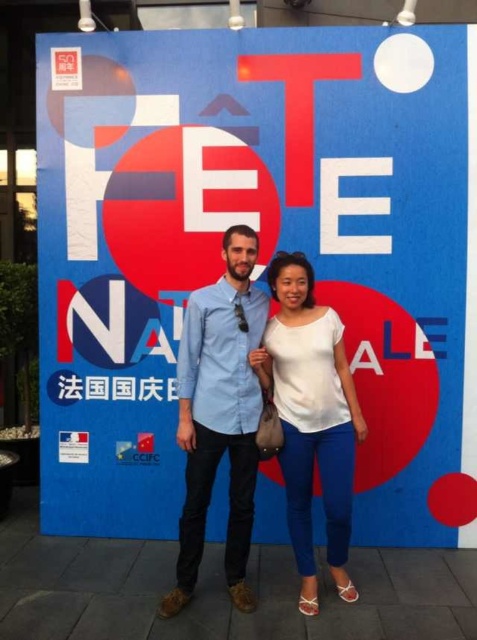
You are a photographer who needs to capture a clear photo of both the blue denim shirt at center and the white matte shirt at center. The camera has a focus range of 10 inches. Can you focus on both shirts at the same time?

The blue denim shirt at center and the white matte shirt at center are 10.70 inches apart. Since the camera can only focus within 10 inches, the distance between them exceeds the focus range. Therefore, you cannot focus on both shirts simultaneously.

You are a photographer standing 5 meters away from the camera. You want to take a photo of the blue denim shirt at center. Can you reach it without moving the camera?

The blue denim shirt at center is 3.33 meters away from the camera. Since you are standing 5 meters away from the camera, you are farther than the subject. To take the photo, you would need to move closer to the camera or adjust your position so that you can capture the blue denim shirt at center within the frame.

You are a photographer standing in front of the poster. You want to take a photo of the blue denim shirt at center so that it appears centered in the frame. Based on its current position, where should you position your camera horizontally and vertically?

The blue denim shirt at center is located at point 0.647 horizontally and 0.461 vertically. To center it in the frame, position your camera so that the center of the frame aligns with these coordinates.